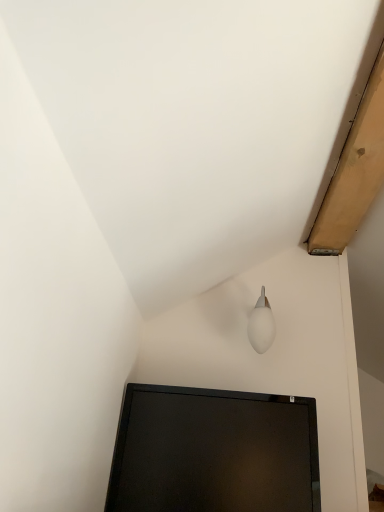
Question: Based on their sizes in the image, would you say white frosted glass lamp at upper right is bigger or smaller than black glossy monitor at lower center?

Choices:
 (A) small
 (B) big

Answer: (A)

Question: From a real-world perspective, is white frosted glass lamp at upper right physically located above or below black glossy monitor at lower center?

Choices:
 (A) above
 (B) below

Answer: (A)

Question: From the image's perspective, is white frosted glass lamp at upper right located above or below black glossy monitor at lower center?

Choices:
 (A) below
 (B) above

Answer: (B)

Question: Looking at the image, does black glossy monitor at lower center seem bigger or smaller compared to white frosted glass lamp at upper right?

Choices:
 (A) small
 (B) big

Answer: (B)

Question: Would you say black glossy monitor at lower center is to the left or to the right of white frosted glass lamp at upper right in the picture?

Choices:
 (A) right
 (B) left

Answer: (B)

Question: From the image's perspective, is black glossy monitor at lower center located above or below white frosted glass lamp at upper right?

Choices:
 (A) above
 (B) below

Answer: (B)

Question: Is black glossy monitor at lower center situated inside white frosted glass lamp at upper right or outside?

Choices:
 (A) inside
 (B) outside

Answer: (B)